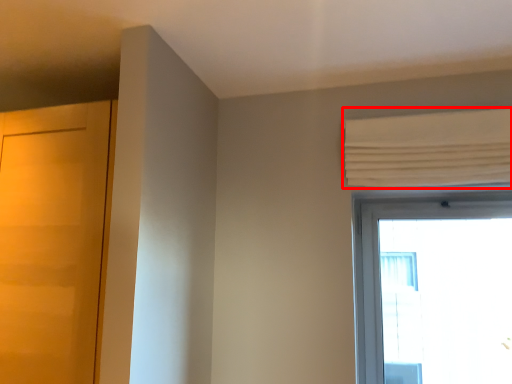
Question: Observing the image, what is the correct spatial positioning of curtain (annotated by the red box) in reference to door?

Choices:
 (A) left
 (B) right

Answer: (B)